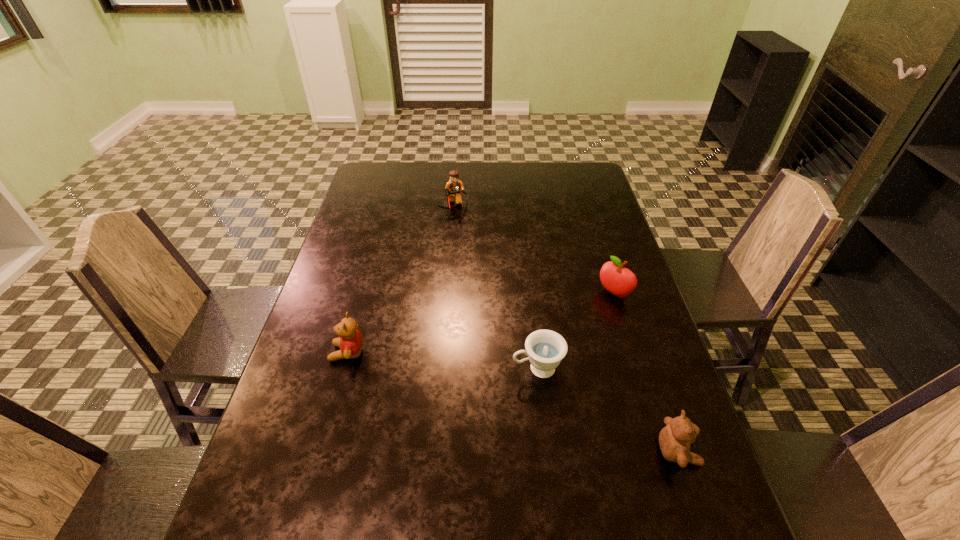
Image resolution: width=960 pixels, height=540 pixels. Identify the location of teddy bear at the right edge. (674, 439).

Identify the location of apple situated at the right edge. This screenshot has width=960, height=540. (615, 278).

At what (x,y) coordinates should I click in order to perform the action: click on object that is at the near right corner. Please return your answer as a coordinate pair (x, y). Looking at the image, I should click on (674, 439).

Identify the location of vacant area at the far edge. (505, 181).

At what (x,y) coordinates should I click in order to perform the action: click on vacant area at the near edge. Please return your answer as a coordinate pair (x, y). This screenshot has width=960, height=540. Looking at the image, I should click on (339, 509).

In the image, there is a desktop. Identify the location of free space at the left edge. (346, 401).

Identify the location of free space at the right edge of the desktop. The image size is (960, 540). (588, 262).

Locate an element on the screen. free space at the far left corner of the desktop is located at coordinates (393, 176).

Image resolution: width=960 pixels, height=540 pixels. In order to click on vacant space at the far right corner in this screenshot , I will do `click(588, 172)`.

At what (x,y) coordinates should I click in order to perform the action: click on vacant area that lies between the fourth nearest object and the farthest object. Please return your answer as a coordinate pair (x, y). Image resolution: width=960 pixels, height=540 pixels. Looking at the image, I should click on [534, 250].